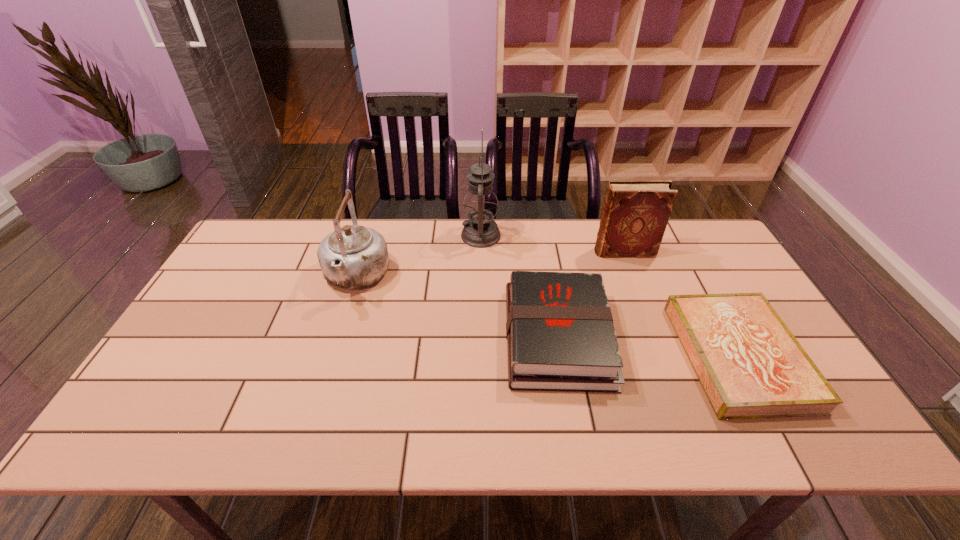
This screenshot has width=960, height=540. Find the location of `vacant point at the near edge`. vacant point at the near edge is located at coordinates (223, 435).

I want to click on vacant region at the left edge of the desktop, so click(x=200, y=338).

In order to click on free location at the far left corner of the desktop in this screenshot , I will do `click(266, 226)`.

Locate an element on the screen. free space at the far right corner is located at coordinates (682, 228).

Find the location of `vacant space that is in between the farthest hardback book and the tallest object`. vacant space that is in between the farthest hardback book and the tallest object is located at coordinates (552, 244).

What are the coordinates of `free space between the farthest hardback book and the tallest object` in the screenshot? It's located at (552, 244).

Identify the location of free spot between the tallest object and the shortest object. Image resolution: width=960 pixels, height=540 pixels. (610, 296).

The image size is (960, 540). Find the location of `vacant region between the oil lamp and the leftmost object`. vacant region between the oil lamp and the leftmost object is located at coordinates (419, 256).

Locate an element on the screen. This screenshot has width=960, height=540. vacant area between the shortest hardback book and the oil lamp is located at coordinates (610, 296).

At what (x,y) coordinates should I click in order to perform the action: click on empty space between the kettle and the tallest object. Please return your answer as a coordinate pair (x, y). Looking at the image, I should click on (419, 256).